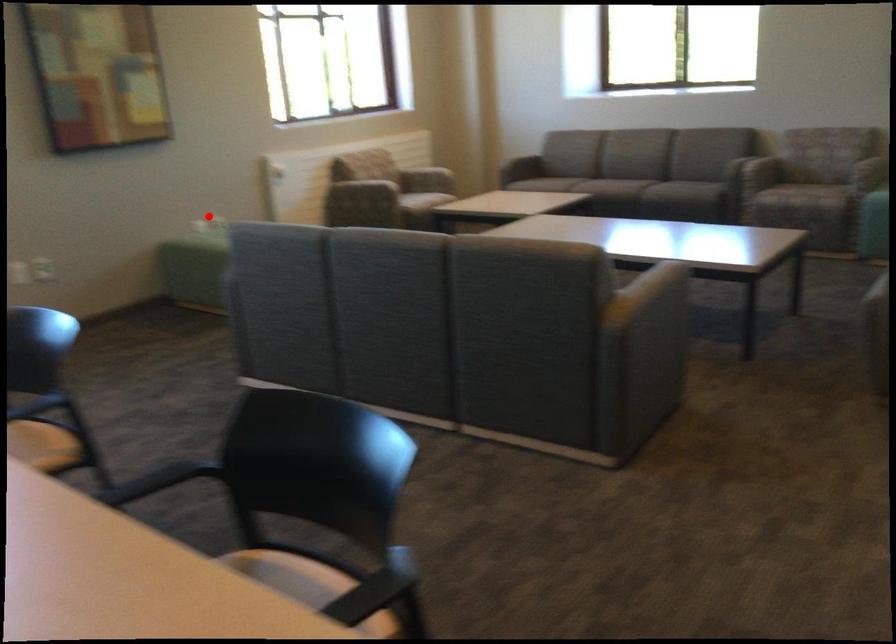
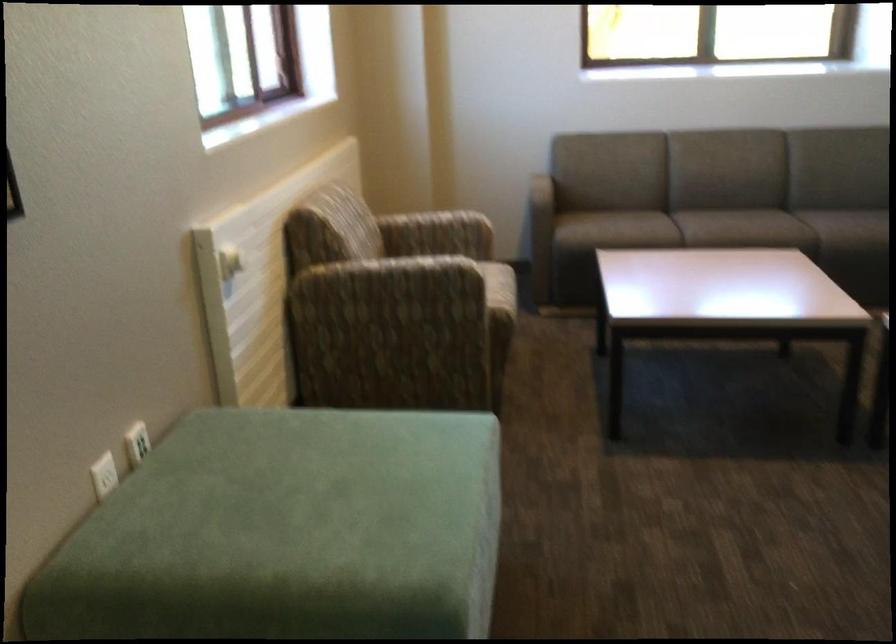
The point at the highlighted location is marked in the first image. Where is the corresponding point in the second image?

(136, 442)